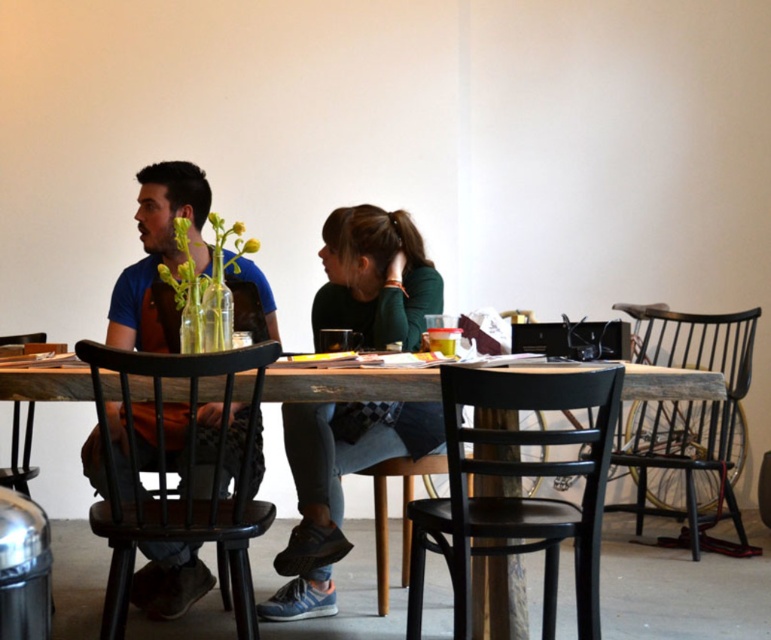
You are a photographer setting up for a portrait shoot in this room. You have a camera that requires a subject to be at least 1.5 meters tall. Looking at the matte blue shirt at left and the dark brown wooden chair at lower left, which one would be suitable for your shoot based on height requirements?

The matte blue shirt at left is taller than the dark brown wooden chair at lower left, so the matte blue shirt at left would be suitable for the portrait shoot as it meets the height requirement.

What is located at the coordinates point [160,257]?

The point [160,257] is occupied by the matte blue shirt at left.